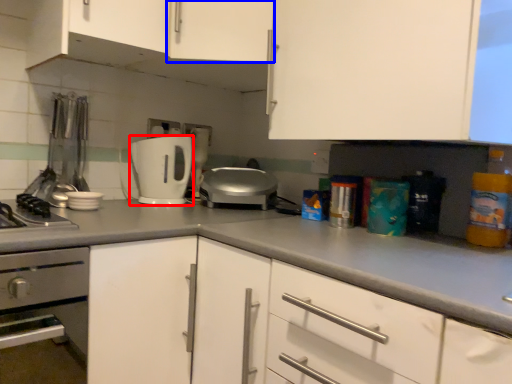
Question: Which object is further to the camera taking this photo, toaster (highlighted by a red box) or cabinetry (highlighted by a blue box)?

Choices:
 (A) toaster
 (B) cabinetry

Answer: (A)